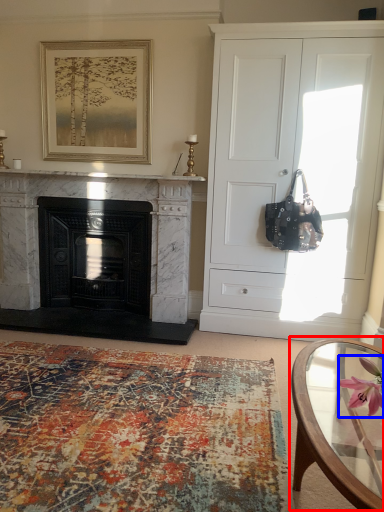
Question: Among these objects, which one is nearest to the camera, coffee table (highlighted by a red box) or flower (highlighted by a blue box)?

Choices:
 (A) coffee table
 (B) flower

Answer: (A)